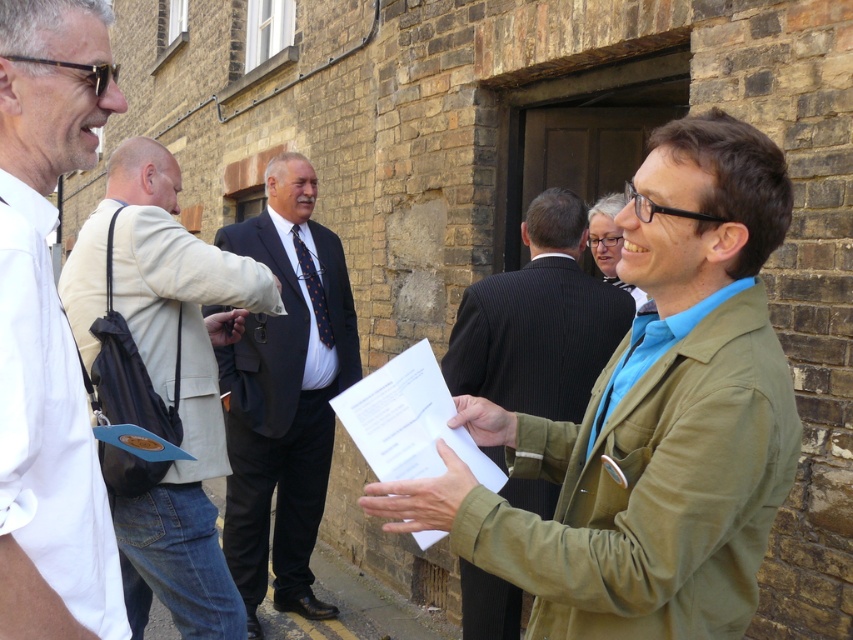
You are a photographer trying to capture a photo of the group. You want to ensure both the light beige jacket at center and the green textured jacket at center are in focus. Which jacket should you position closer to the camera to ensure both are in focus?

The light beige jacket at center is to the left of the green textured jacket at center. To ensure both are in focus, position the light beige jacket at center closer to the camera so that the depth of field can cover both jackets effectively.

You are a photographer positioned in front of the brick building. You notice two jackets in the scene, the light beige jacket at center and the green textured jacket at center. Which jacket is positioned closer to you?

The light beige jacket at center is closer to the viewer than the green textured jacket at center, so the light beige jacket at center is positioned closer to you.